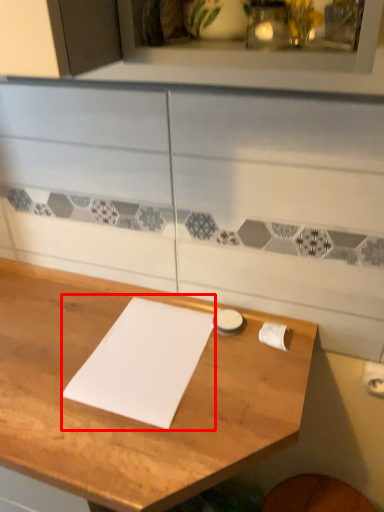
Question: From the image's perspective, where is journal (annotated by the red box) located in relation to table in the image?

Choices:
 (A) above
 (B) below

Answer: (A)